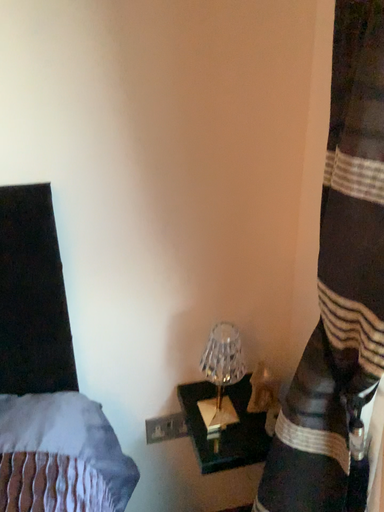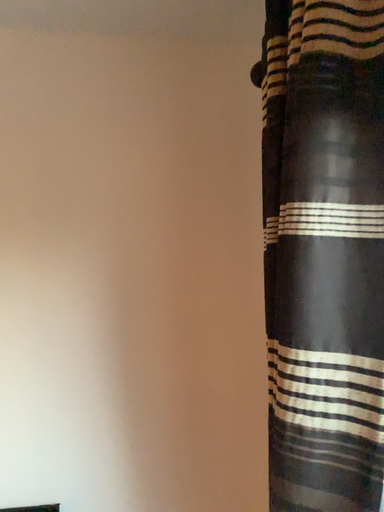
Question: Which way did the camera rotate in the video?

Choices:
 (A) rotated upward
 (B) rotated downward

Answer: (A)